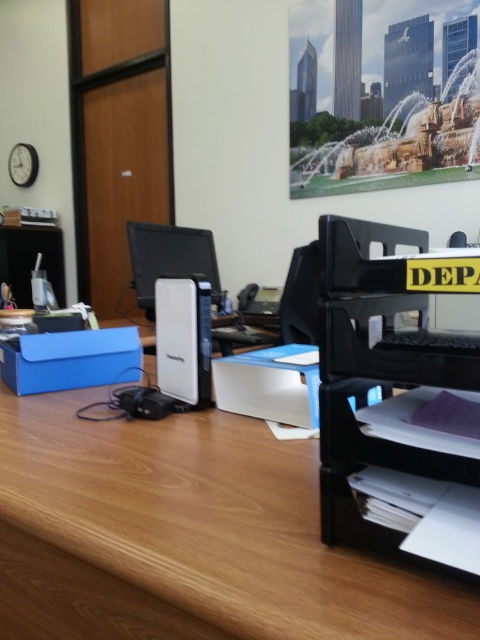
You are organizing the desk and need to place a new item between the black plastic printer at right and the white matte box at center. Based on their positions, where should you place the new item?

The black plastic printer at right is to the right of the white matte box at center, so you should place the new item between them, to the right of the white matte box at center and to the left of the black plastic printer at right.

You are setting up a new computer monitor that needs to be placed exactly at point 0.559, 0.779 on the desk. However, there is already a black plastic printer at right located at that coordinate. Can you place the new monitor there without moving the printer?

The black plastic printer at right is already positioned at point (373, 356), so the new monitor cannot be placed there without moving the printer.

You are taking a photo of the desk and want to ensure both the point at (91, 355) and the point at (232, 404) are in focus. Which point should you focus on first to ensure both are sharp?

You should focus on point (232, 404) first because it is closer to the camera than point (91, 355), so focusing on the closer point will help ensure both are in focus.